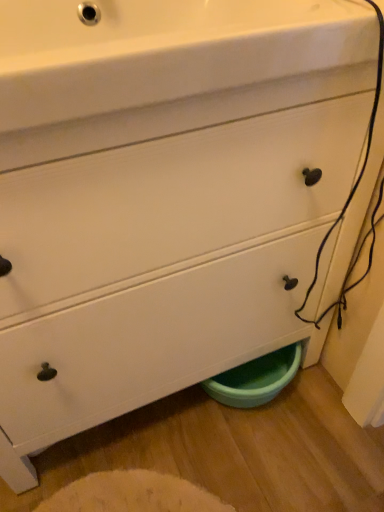
What do you see at coordinates (165, 51) in the screenshot? I see `white glossy sink at upper center` at bounding box center [165, 51].

I want to click on white glossy sink at upper center, so click(x=165, y=51).

Identify the location of white glossy sink at upper center. The image size is (384, 512). (165, 51).